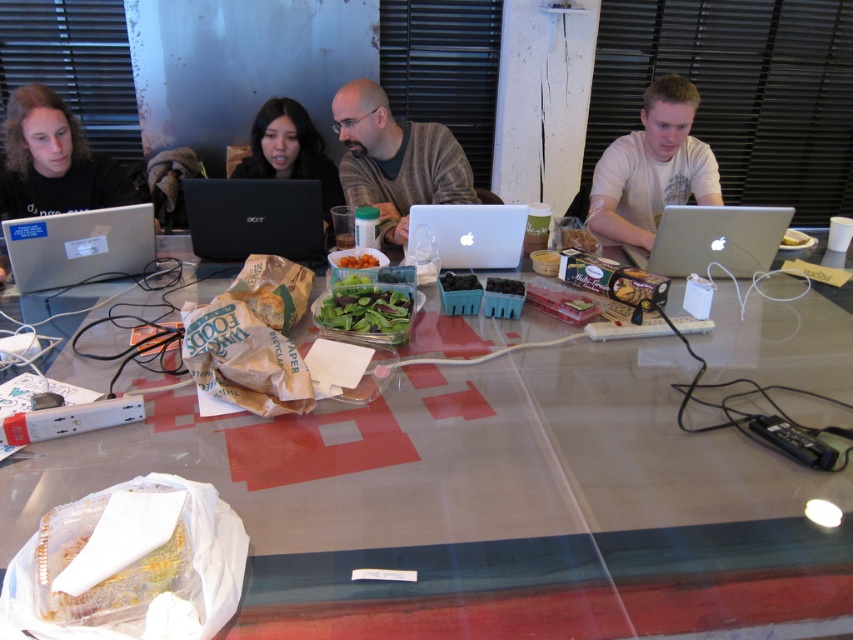
In the scene shown: You are a delivery person who needs to place a new item between the green leafy salad at center and the orange matte tomatoes at center on the table. The item requires a minimum of 10 inches of space between them. Can you fit it there?

The distance between the green leafy salad at center and the orange matte tomatoes at center is 10.19 inches, which is just over the required 10 inches. Therefore, you can fit the item between them.

From the picture: You are organizing a lunch meeting for the four people around the table. The green leafy salad at center and the orange matte tomatoes at center are the only food items available. Considering their sizes, which food item can comfortably serve more people?

The green leafy salad at center has a larger width than the orange matte tomatoes at center, so it can comfortably serve more people.

You are a nutritionist who needs to arrange a healthy meal for a client. You have a green leafy salad at center and orange matte tomatoes at center. According to their positions, which one should you pick first to ensure proper arrangement?

The orange matte tomatoes at center should be picked first because the green leafy salad at center is positioned on its right side, so the tomatoes are on the left and should be arranged first from left to right.